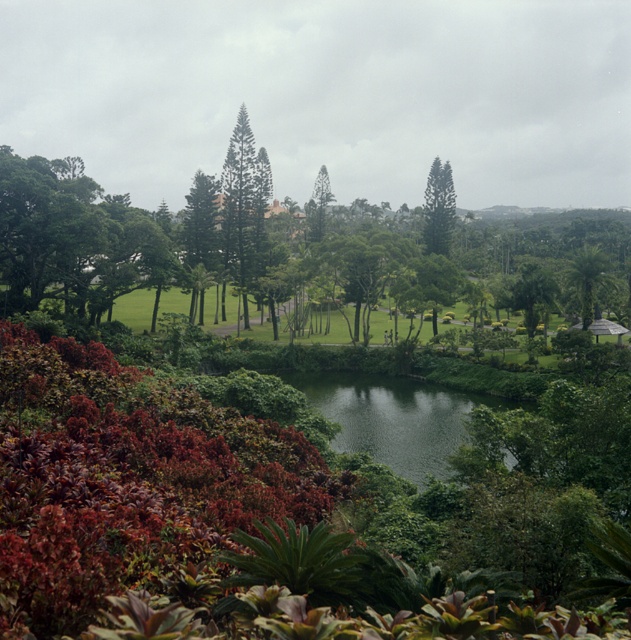
You are a landscape architect designing a garden. You need to place a small statue between the green textured pine tree at center and the green textured tree at center. Which tree should the statue be closer to if you want it to appear proportionally balanced with both trees?

The statue should be closer to the green textured pine tree at center because it is smaller than the green textured tree at center, so balancing their sizes would require placing the statue nearer to the smaller tree to maintain visual harmony.

You are a landscape architect designing a pathway that needs to pass between the green leafy palm at right and the green textured tree at center. Considering their sizes, which tree should the pathway be closer to?

The pathway should be closer to the green textured tree at center because the green leafy palm at right is larger in size, requiring more space between them to accommodate its size.

You are standing at the center of the tropical landscape and want to find the green textured pine tree at center. According to the coordinates provided, where should you look relative to your position?

The green textured pine tree at center is located at coordinates point (244, 205), which is slightly to the left and lower than the exact center point of the image.